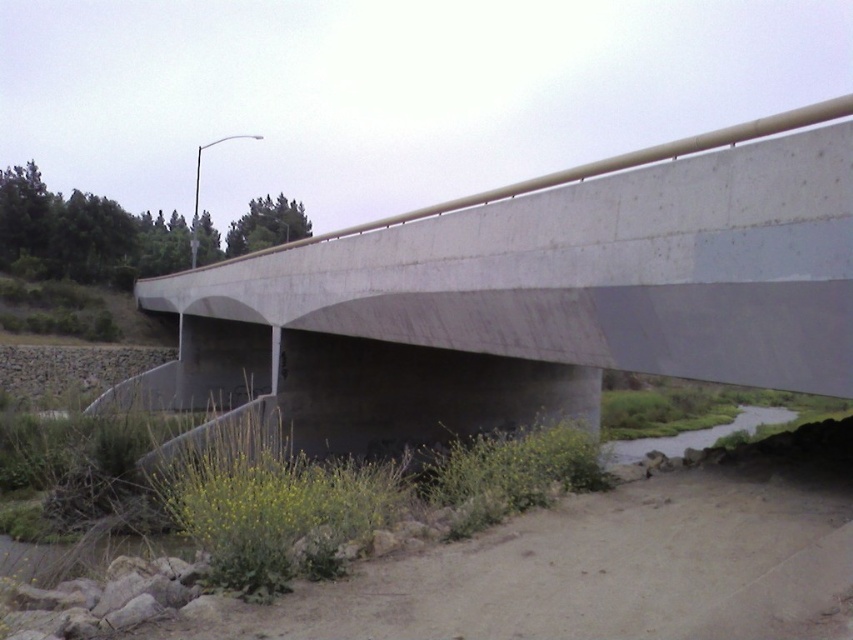
Question: In this image, where is concrete bridge at center located relative to green grassy river at lower right?

Choices:
 (A) right
 (B) left

Answer: (B)

Question: Which point appears closest to the camera in this image?

Choices:
 (A) (791, 417)
 (B) (219, 324)

Answer: (B)

Question: Is concrete bridge at center below green grassy river at lower right?

Choices:
 (A) yes
 (B) no

Answer: (B)

Question: Is concrete bridge at center positioned behind green grassy river at lower right?

Choices:
 (A) no
 (B) yes

Answer: (A)